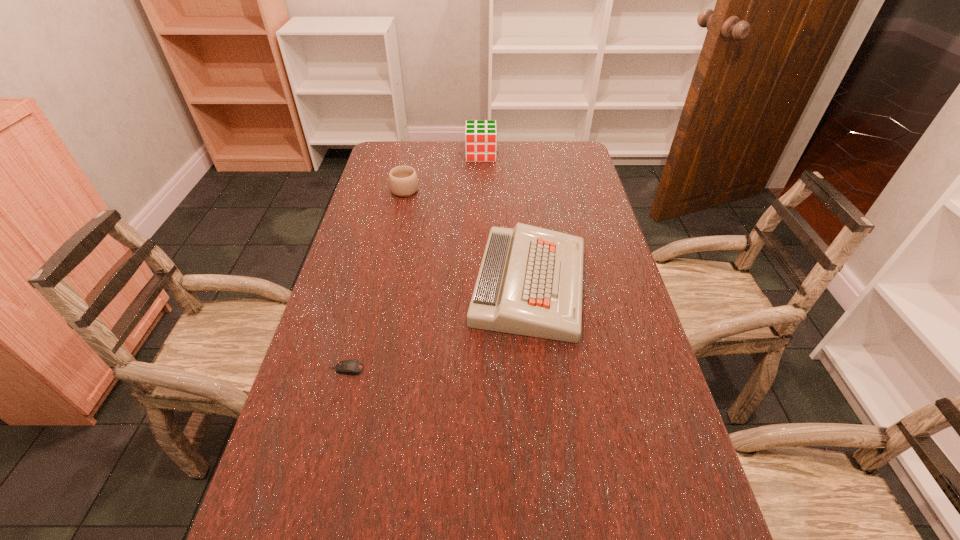
In the image, there is a desktop. What are the coordinates of `vacant space at the far right corner` in the screenshot? It's located at (567, 160).

Where is `free space between the mug and the tallest object`? This screenshot has width=960, height=540. free space between the mug and the tallest object is located at coordinates (444, 172).

Locate an element on the screen. This screenshot has height=540, width=960. free point between the farthest object and the computer mouse is located at coordinates (414, 262).

You are a GUI agent. You are given a task and a screenshot of the screen. Output one action in this format:
    pyautogui.click(x=<x>, y=<y>)
    Task: Click on the empty location between the farthest object and the second farthest object
    
    Given the screenshot: What is the action you would take?
    pyautogui.click(x=444, y=172)

Identify the location of vacant space that's between the third farthest object and the mug. This screenshot has height=540, width=960. (468, 237).

Identify the location of free space between the mug and the second nearest object. The height and width of the screenshot is (540, 960). point(468,237).

This screenshot has height=540, width=960. In order to click on unoccupied position between the shortest object and the cube in this screenshot , I will do `click(414, 262)`.

Find the location of a particular element. Image resolution: width=960 pixels, height=540 pixels. empty space that is in between the computer keyboard and the cube is located at coordinates click(505, 219).

Locate an element on the screen. free spot between the second nearest object and the cube is located at coordinates (505, 219).

Where is `empty location between the mug and the computer keyboard`? This screenshot has width=960, height=540. empty location between the mug and the computer keyboard is located at coordinates (468, 237).